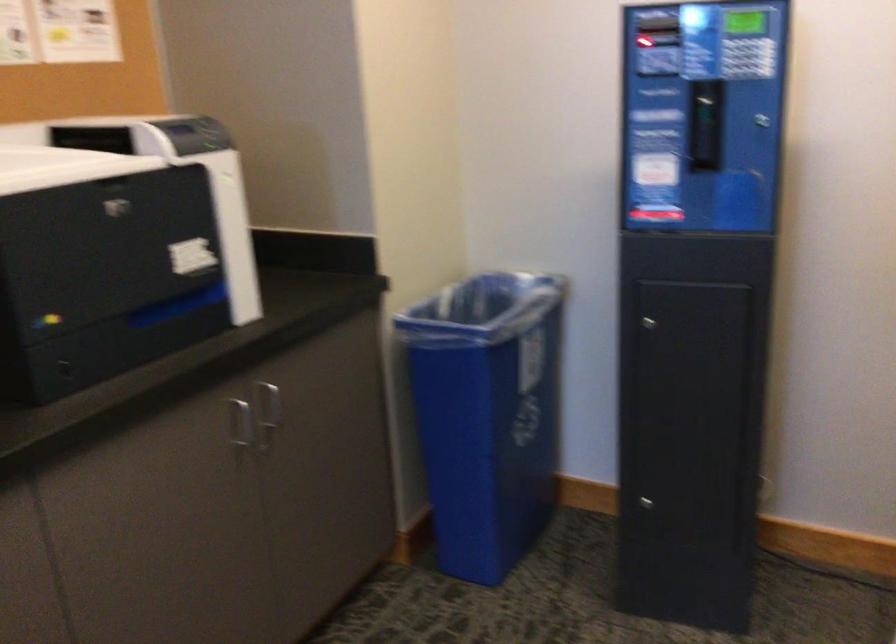
The location [487,413] corresponds to which object?

This point indicates the blue recycling bin.